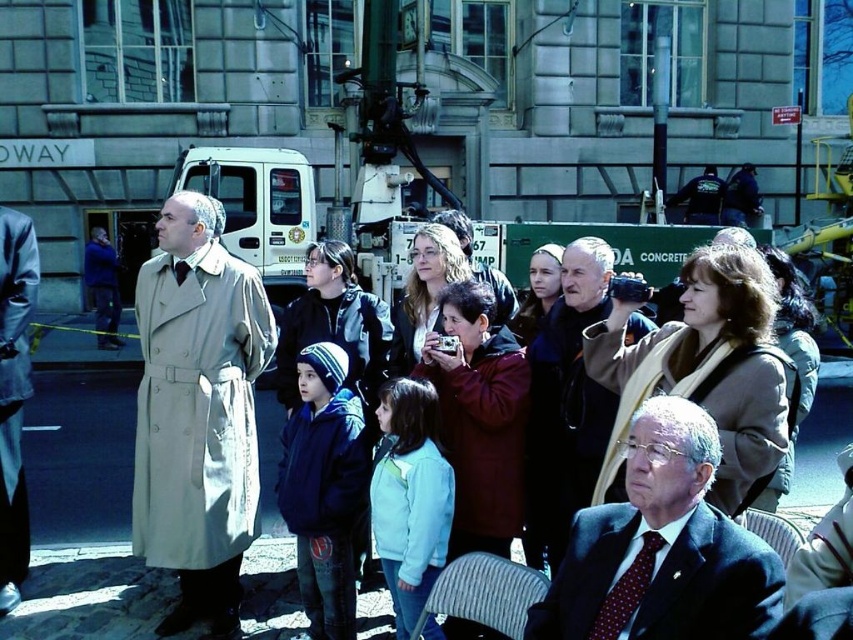
Question: Is dark blue suit at lower right positioned in front of light beige trench coat at left?

Choices:
 (A) yes
 (B) no

Answer: (A)

Question: Is beige fabric trench coat at left closer to camera compared to brown leather jacket at center?

Choices:
 (A) no
 (B) yes

Answer: (A)

Question: Can you confirm if brown leather jacket at center is wider than light beige trench coat at left?

Choices:
 (A) no
 (B) yes

Answer: (B)

Question: Which object is closer to the camera taking this photo?

Choices:
 (A) light beige trench coat at left
 (B) dark blue suit at lower right

Answer: (B)

Question: Considering the real-world distances, which object is closest to the brown leather jacket at center?

Choices:
 (A) light beige trench coat at left
 (B) beige fabric trench coat at left

Answer: (B)

Question: Among these points, which one is nearest to the camera?

Choices:
 (A) pyautogui.click(x=656, y=586)
 (B) pyautogui.click(x=20, y=314)

Answer: (A)